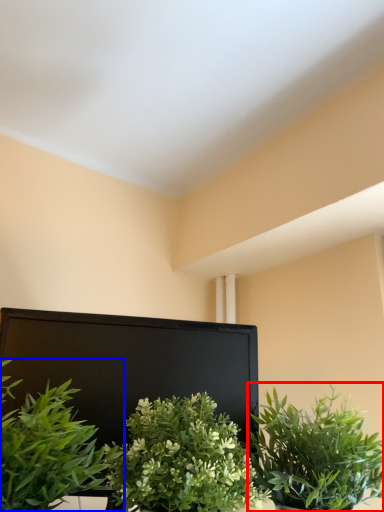
Question: Among these objects, which one is nearest to the camera, houseplant (highlighted by a red box) or houseplant (highlighted by a blue box)?

Choices:
 (A) houseplant
 (B) houseplant

Answer: (B)